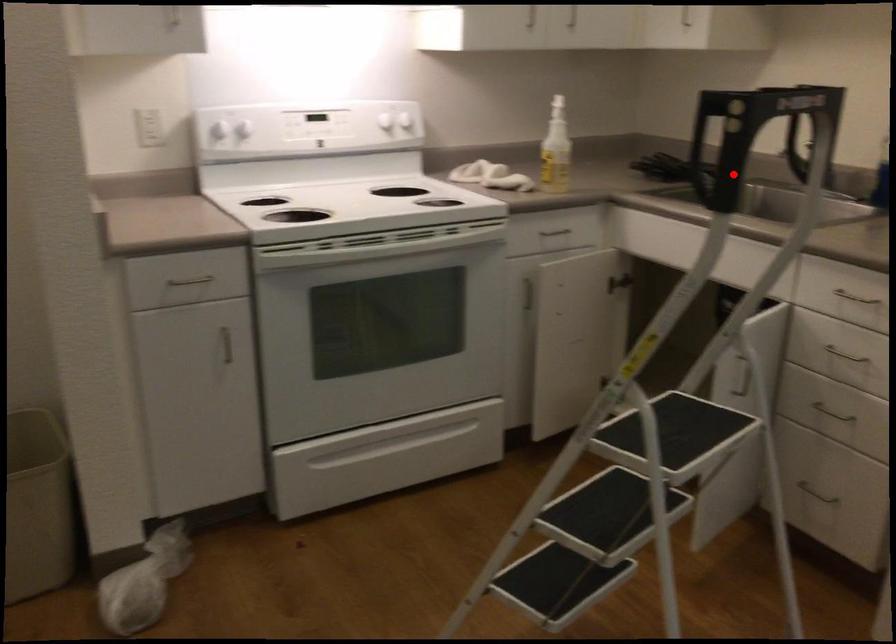
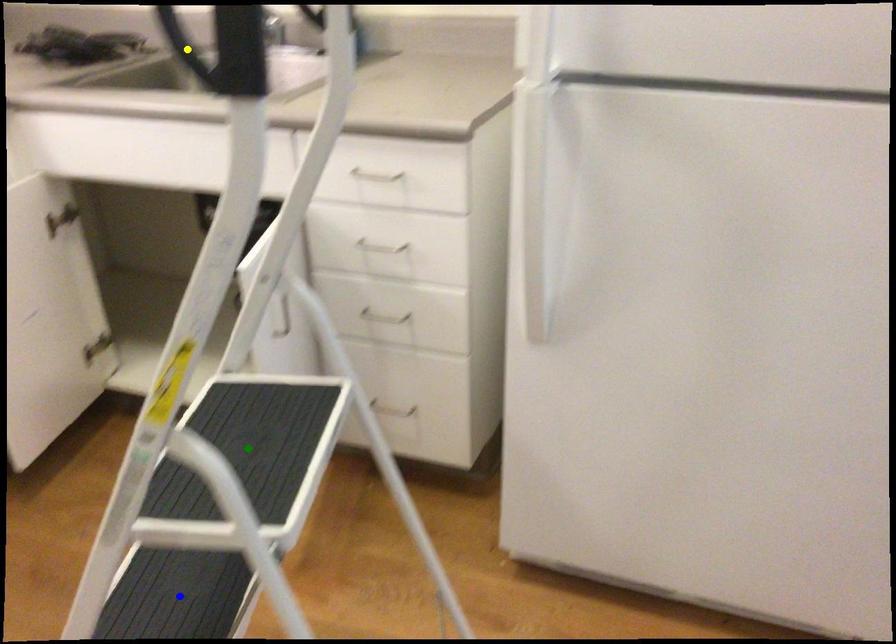
Question: I am providing you with two images of the same scene from different viewpoints. A red point is marked on the first image. You are given multiple points on the second image. Can you choose the point in image 2 that corresponds to the point in image 1?

Choices:
 (A) yellow point
 (B) blue point
 (C) green point

Answer: (A)